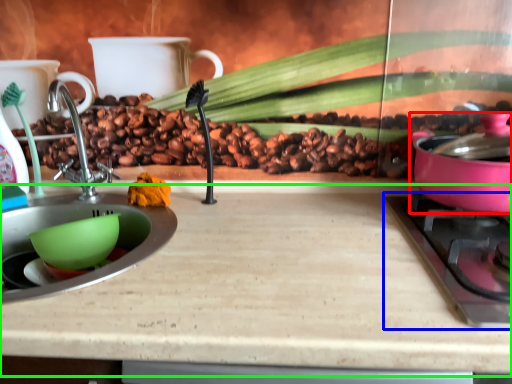
Question: Which is nearer to the kitchen appliance (highlighted by a red box)? gas stove (highlighted by a blue box) or counter top (highlighted by a green box).

Choices:
 (A) gas stove
 (B) counter top

Answer: (A)